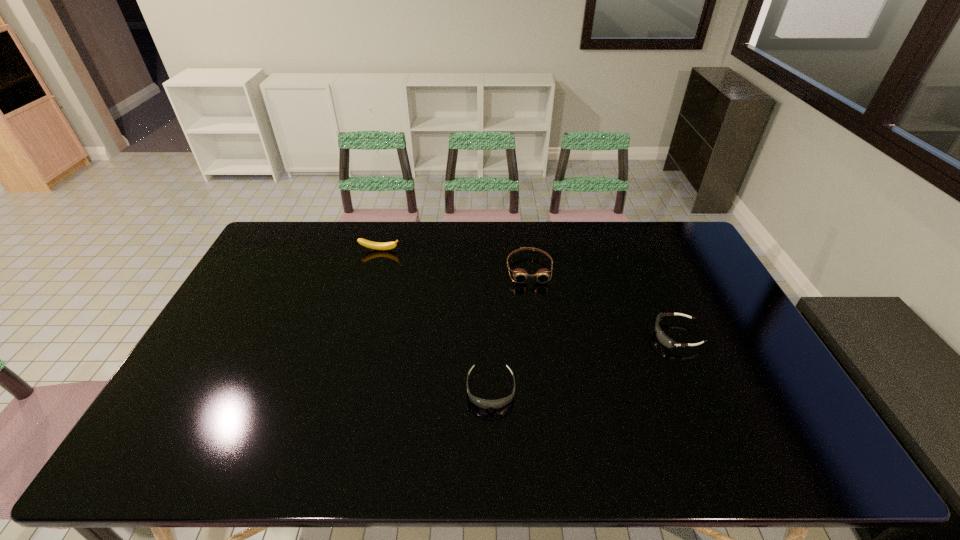
Locate an element on the screen. free space at the right edge is located at coordinates (764, 408).

You are a GUI agent. You are given a task and a screenshot of the screen. Output one action in this format:
    pyautogui.click(x=<x>, y=<y>)
    Task: Click on the vacant space at the far left corner of the desktop
    The image size is (960, 540).
    Given the screenshot: What is the action you would take?
    pyautogui.click(x=275, y=244)

Identify the location of vacant space at the near left corner of the desktop. This screenshot has width=960, height=540. [141, 463].

Find the location of a particular element. This screenshot has height=540, width=960. blank area at the far right corner is located at coordinates (654, 246).

Locate an element on the screen. free spot between the third nearest object and the third object from right to left is located at coordinates (510, 329).

Where is `vacant area between the banana and the leftmost goggles`? vacant area between the banana and the leftmost goggles is located at coordinates (435, 320).

The image size is (960, 540). Identify the location of vacant space that's between the third nearest object and the second nearest object. (603, 302).

This screenshot has height=540, width=960. Identify the location of free space between the leftmost goggles and the rightmost goggles. (584, 362).

This screenshot has height=540, width=960. Identify the location of vacant area between the farthest object and the second goggles from left to right. (454, 260).

In order to click on empty space between the second goggles from left to right and the second object from left to right in this screenshot , I will do `click(510, 329)`.